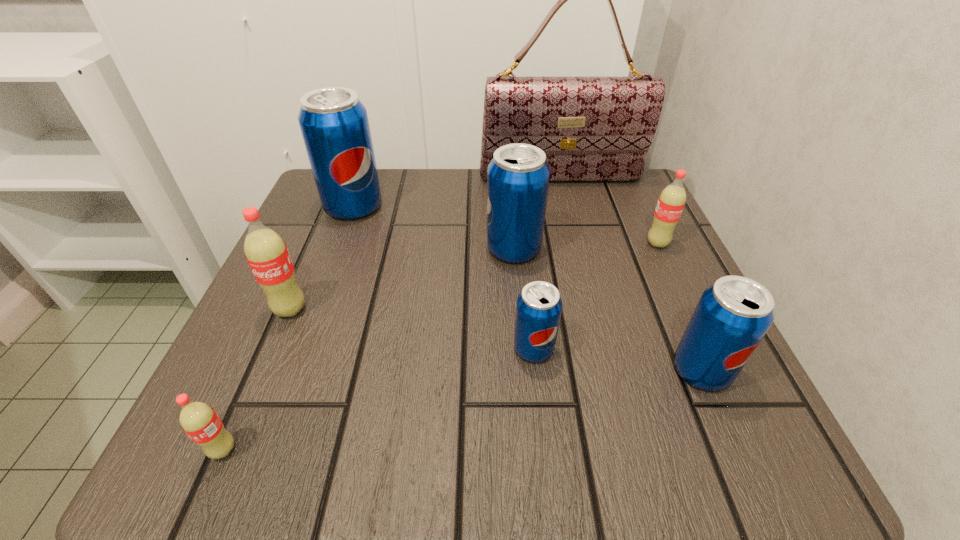
Locate an element on the screen. handbag is located at coordinates (591, 128).

In order to click on the farthest object in this screenshot , I will do `click(591, 128)`.

Where is `the biggest blue pop soda`? This screenshot has height=540, width=960. the biggest blue pop soda is located at coordinates (334, 123).

Identify the location of the seventh shortest object. The image size is (960, 540). (334, 123).

Find the location of a particular element. The image size is (960, 540). the second biggest blue pop soda is located at coordinates (518, 176).

Where is `the biggest red soda`? the biggest red soda is located at coordinates (266, 252).

Image resolution: width=960 pixels, height=540 pixels. I want to click on the fourth nearest object, so click(266, 252).

This screenshot has width=960, height=540. I want to click on the second smallest red soda, so click(671, 201).

At what (x,y) coordinates should I click in order to perform the action: click on the farthest red soda. Please return your answer as a coordinate pair (x, y). Looking at the image, I should click on (671, 201).

Identify the location of the rightmost blue pop soda. This screenshot has width=960, height=540. (733, 315).